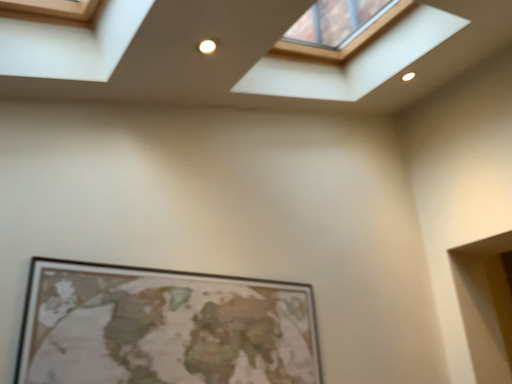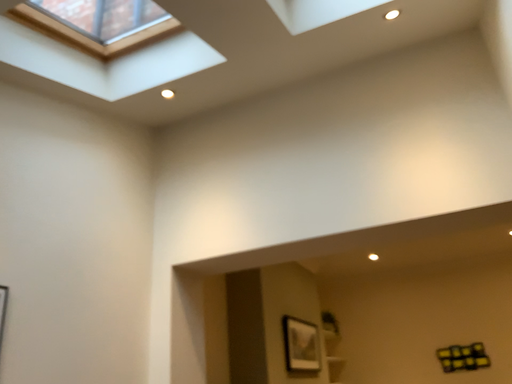
Question: Which way did the camera rotate in the video?

Choices:
 (A) rotated left
 (B) rotated right

Answer: (B)